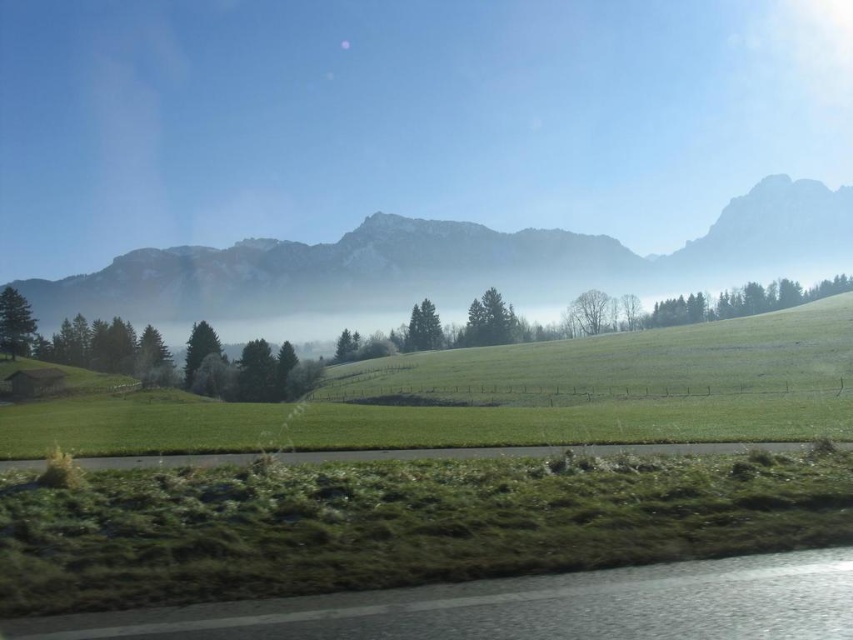
Looking at this image, you are a hiker standing at the point with coordinates (x=445, y=269) in the image. What can you see directly in front of you?

At point (x=445, y=269) lies rocky gray mountain at center, so you can see the rocky gray mountain at center directly in front of you.

You are driving a delivery truck that requires a road longer than 100 meters. You see the black asphalt highway at lower left and the gray asphalt road at lower center. Which road should you choose?

The gray asphalt road at lower center is longer than the black asphalt highway at lower left. Since the gray asphalt road at lower center is longer, you should choose it because it meets the requirement of being longer than 100 meters.

You are standing at the point closer to the camera in the image. Which point are you at, point (567, 253) or point (291, 456)?

You are at point (291, 456) because it is closer to the camera than point (567, 253).